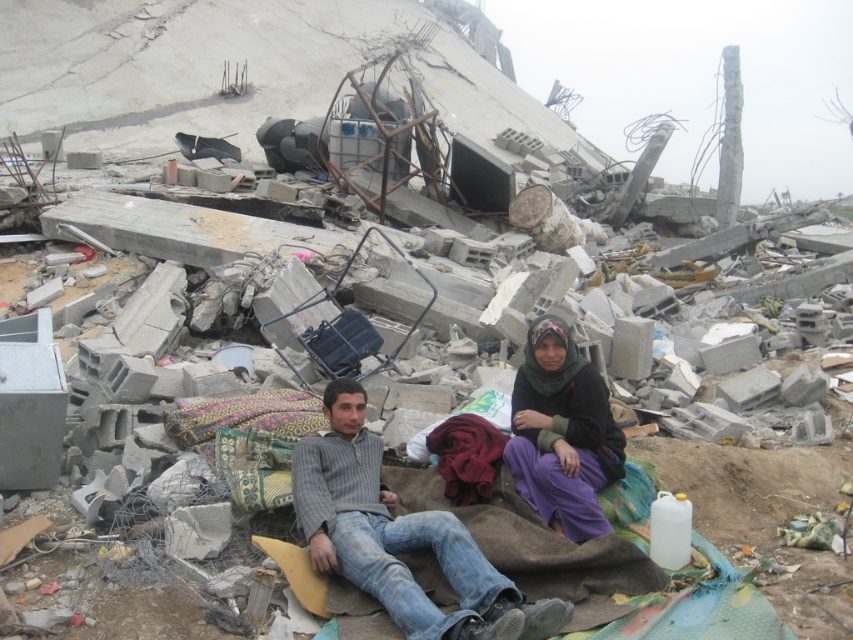
Who is shorter, gray striped sweater at center or purple cotton dress at center?

Standing shorter between the two is gray striped sweater at center.

Who is positioned more to the right, gray striped sweater at center or purple cotton dress at center?

purple cotton dress at center is more to the right.

Between point (467, 554) and point (561, 474), which one is positioned in front?

Point (467, 554) is in front.

You are a GUI agent. You are given a task and a screenshot of the screen. Output one action in this format:
    pyautogui.click(x=<x>, y=<y>)
    Task: Click on the gray striped sweater at center
    
    Given the screenshot: What is the action you would take?
    pyautogui.click(x=398, y=538)